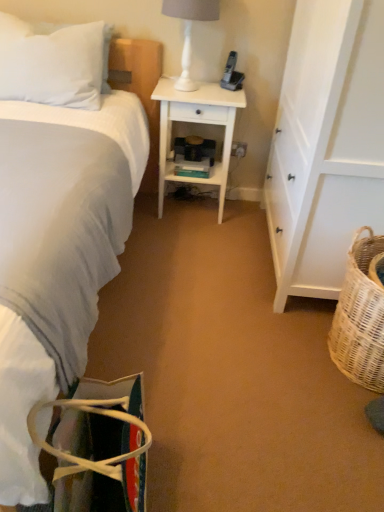
This screenshot has width=384, height=512. In order to click on vacant area that is in front of black plastic phone at upper center in this screenshot , I will do `click(221, 94)`.